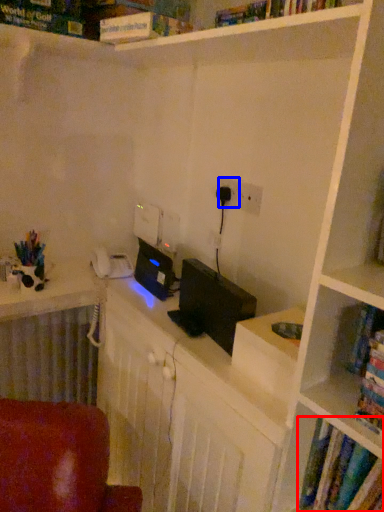
Question: Which of the following is the closest to the observer, book (highlighted by a red box) or electric outlet (highlighted by a blue box)?

Choices:
 (A) book
 (B) electric outlet

Answer: (A)